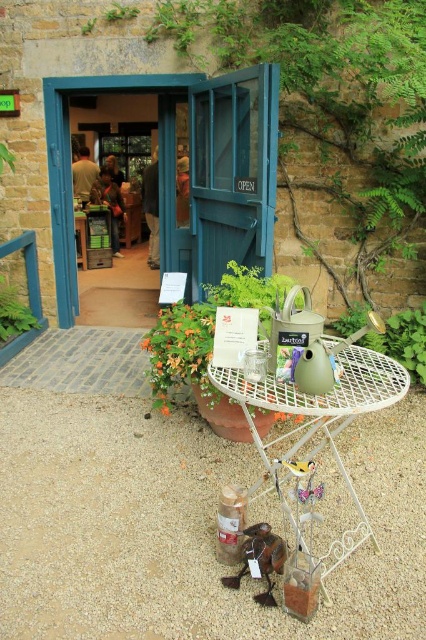
Question: Which of the following is the closest to the observer?

Choices:
 (A) (302, 541)
 (B) (8, 298)

Answer: (A)

Question: Where is brown gravel at lower center located in relation to green leafy plant at center in the image?

Choices:
 (A) below
 (B) above

Answer: (A)

Question: Does green matte watering can at center-right lie behind wooden bird at lower center?

Choices:
 (A) yes
 (B) no

Answer: (A)

Question: Which object is closer to the camera taking this photo?

Choices:
 (A) blue wooden door at center
 (B) green matte watering can at center
 (C) brown gravel at lower center

Answer: (B)

Question: Is green matte watering can at center below green matte watering can at center-right?

Choices:
 (A) yes
 (B) no

Answer: (A)

Question: Which of the following is the farthest from the observer?

Choices:
 (A) green leafy plant at center
 (B) green leafy plant at lower left
 (C) wooden bird at lower center

Answer: (B)